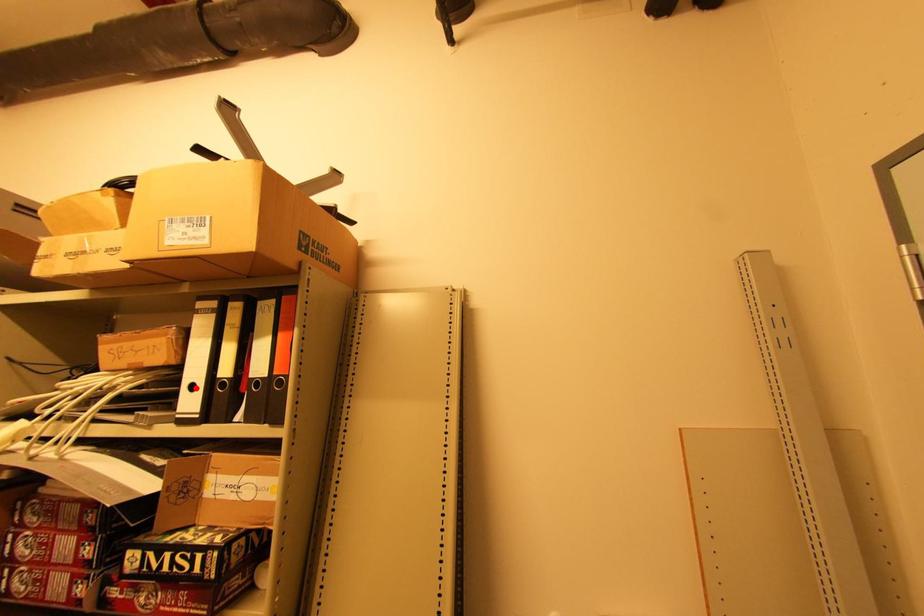
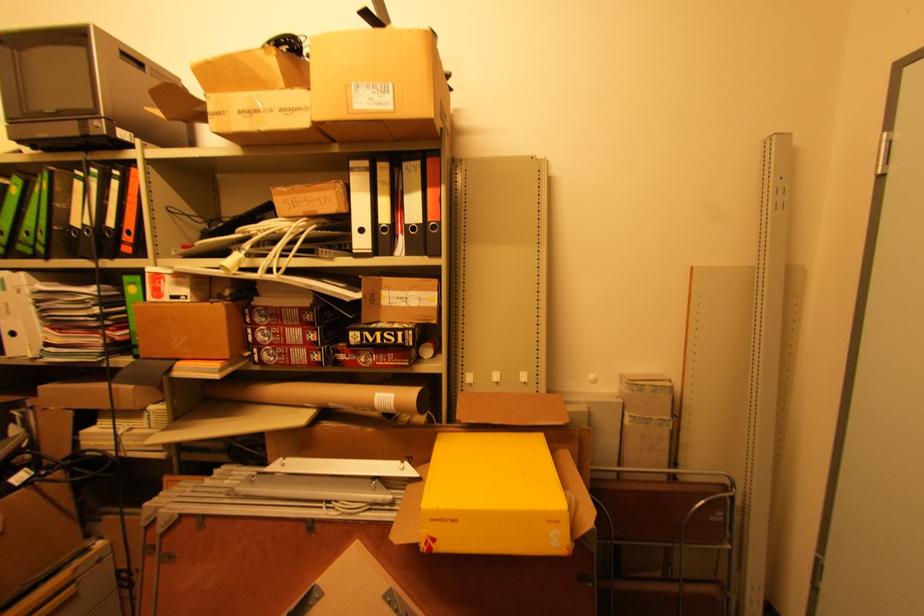
Where in the second image is the point corresponding to the highlighted location from the first image?

(365, 231)